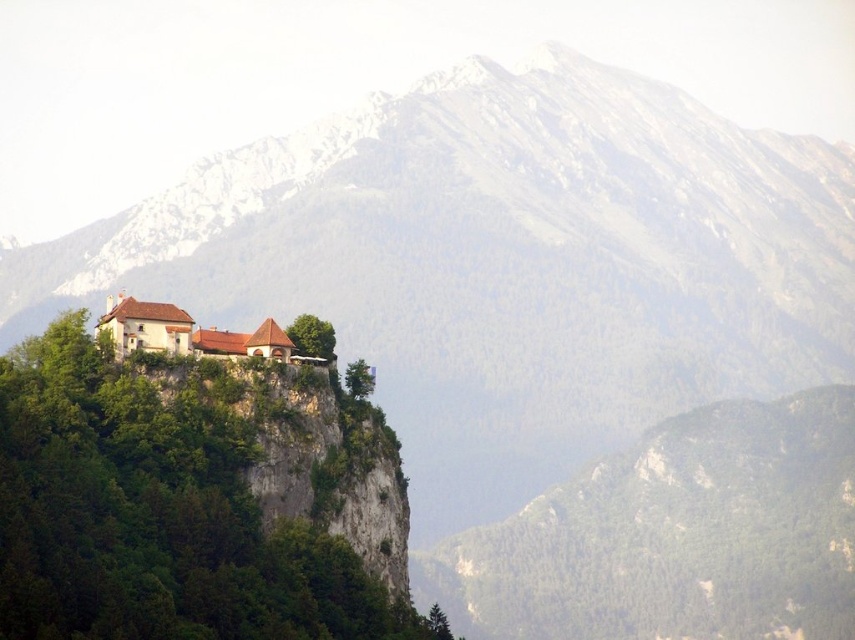
Who is positioned more to the right, green forested hill at center or white stone building at center?

green forested hill at center is more to the right.

Is point (517, 611) closer to camera compared to point (169, 324)?

That is False.

This screenshot has height=640, width=855. Describe the element at coordinates (675, 536) in the screenshot. I see `green forested hill at center` at that location.

Locate an element on the screen. green forested hill at center is located at coordinates (675, 536).